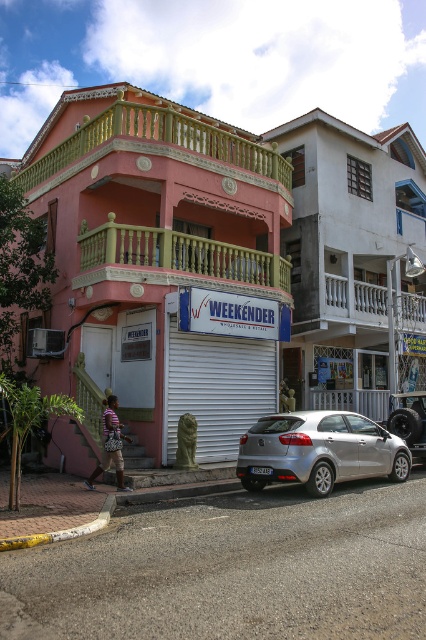
Question: Does matte pink building at center lie behind silver metallic hatchback at center?

Choices:
 (A) no
 (B) yes

Answer: (B)

Question: Which object appears farthest from the camera in this image?

Choices:
 (A) striped fabric shirt at lower left
 (B) matte pink building at center
 (C) silver metallic hatchback at center

Answer: (B)

Question: Which of the following is the closest to the observer?

Choices:
 (A) (279, 292)
 (B) (111, 424)
 (C) (388, 387)

Answer: (B)

Question: Does matte pink building at center have a larger size compared to white matte signboard at center?

Choices:
 (A) no
 (B) yes

Answer: (B)

Question: In this image, where is white matte signboard at center located relative to striped fabric shirt at lower left?

Choices:
 (A) below
 (B) above

Answer: (B)

Question: Which point is closer to the camera taking this photo?

Choices:
 (A) (195, 125)
 (B) (337, 419)

Answer: (B)